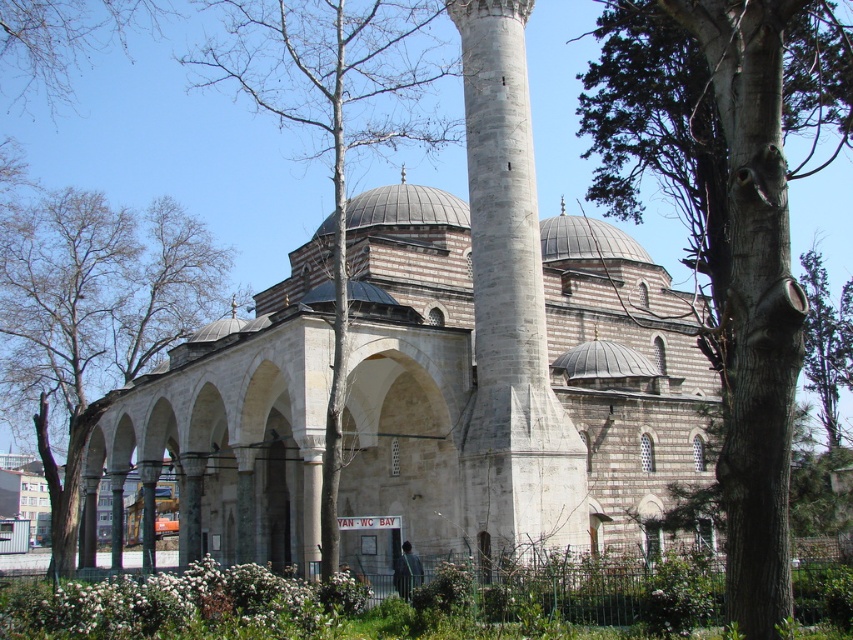
Question: Does brown rough tree at center appear on the right side of bare wood tree at center?

Choices:
 (A) yes
 (B) no

Answer: (A)

Question: Which of these objects is positioned farthest from the brown rough tree at center?

Choices:
 (A) bare wood tree at center
 (B) green leafy tree at left

Answer: (B)

Question: Can you confirm if green leafy tree at left is positioned to the left of smooth stone minaret at center?

Choices:
 (A) yes
 (B) no

Answer: (A)

Question: Which object is positioned closest to the green leafy tree at left?

Choices:
 (A) smooth stone minaret at center
 (B) brown rough tree at center
 (C) bare wood tree at center

Answer: (C)

Question: Which object appears closest to the camera in this image?

Choices:
 (A) bare wood tree at center
 (B) green leafy tree at left

Answer: (A)

Question: Where is green leafy tree at left located in relation to bare wood tree at center in the image?

Choices:
 (A) above
 (B) below

Answer: (B)